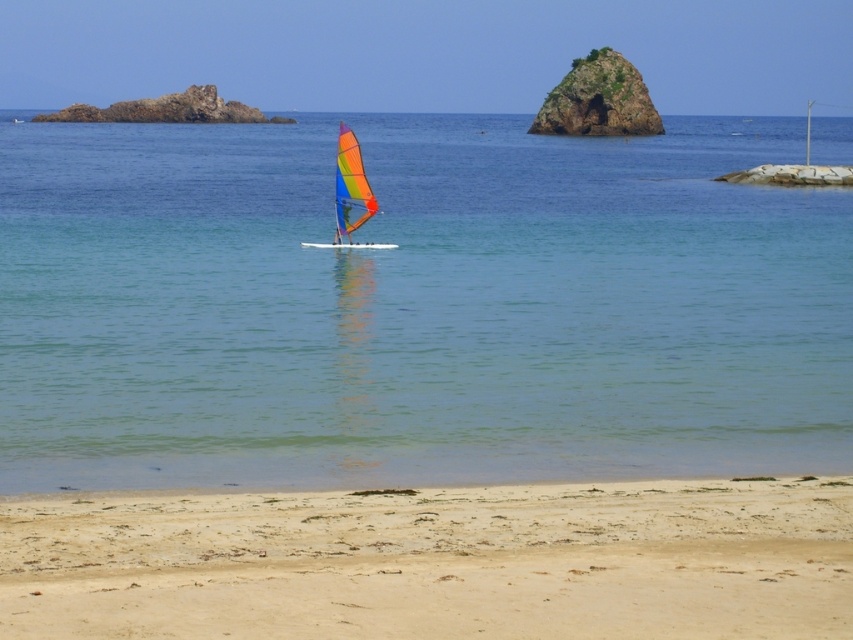
You are standing on the beach and want to take a photo of the clear blue water at center and the green mossy rock at upper center. Which object should you frame first in your camera to ensure both are in the shot?

You should frame the green mossy rock at upper center first because the clear blue water at center is positioned on its left side, so positioning the rock first ensures both are included in the shot.

You are standing on the sandy beach in the foreground of the image. You want to reach the clear blue water at center. Which direction should you walk to get there?

You should walk towards the center of the image to reach the clear blue water at center, as it is located at point coordinates approximately 0.477 on the x and 0.489 on the y axis.

You are a photographer planning to capture the clear blue water at center and the green mossy rock at upper center in a single shot. Considering their sizes, which object will occupy more of the frame?

The clear blue water at center is bigger than the green mossy rock at upper center, so it will occupy more of the frame.